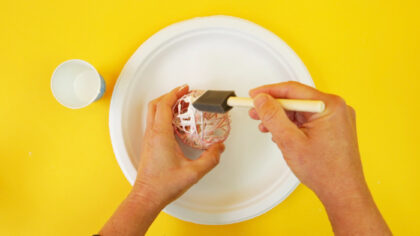
This screenshot has height=236, width=420. In order to click on handle in this screenshot , I will do `click(288, 103)`.